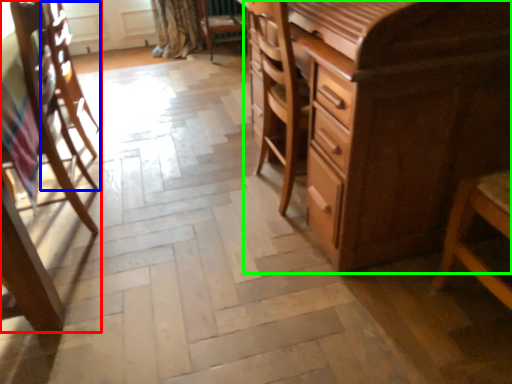
Question: Which is farther away from chair (highlighted by a red box)? armchair (highlighted by a blue box) or chest of drawers (highlighted by a green box)?

Choices:
 (A) armchair
 (B) chest of drawers

Answer: (B)